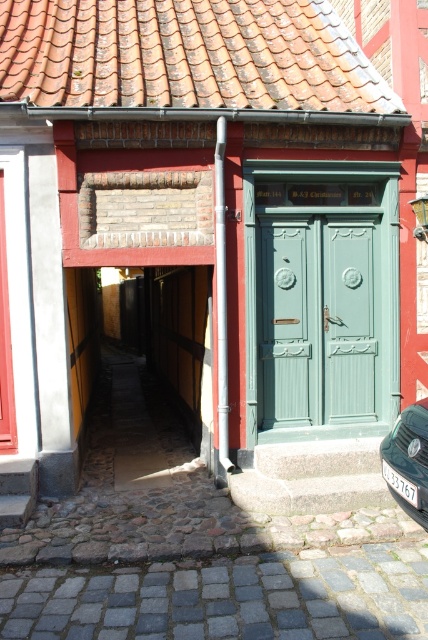
Does point (246, 326) come in front of point (407, 451)?

No, it is behind (407, 451).

Who is lower down, green wooden door at center or metallic silver car at lower right?

metallic silver car at lower right

Which is behind, point (256, 224) or point (424, 406)?

Point (256, 224)

At what (x,y) coordinates should I click in order to perform the action: click on green wooden door at center. Please return your answer as a coordinate pair (x, y). Looking at the image, I should click on point(321,298).

Is green matte door at center below metallic silver car at lower right?

No.

Does green matte door at center have a greater height compared to metallic silver car at lower right?

Indeed, green matte door at center has a greater height compared to metallic silver car at lower right.

At what (x,y) coordinates should I click in order to perform the action: click on green matte door at center. Please return your answer as a coordinate pair (x, y). This screenshot has height=640, width=428. Looking at the image, I should click on (290, 321).

Can you confirm if green wooden door at center is bigger than terracotta clay tiles at upper center?

Incorrect, green wooden door at center is not larger than terracotta clay tiles at upper center.

Does green wooden door at center come behind terracotta clay tiles at upper center?

Yes, green wooden door at center is further from the viewer.

Where is `green wooden door at center`? The width and height of the screenshot is (428, 640). green wooden door at center is located at coordinates (321, 298).

Locate an element on the screen. This screenshot has width=428, height=640. green wooden door at center is located at coordinates (321, 298).